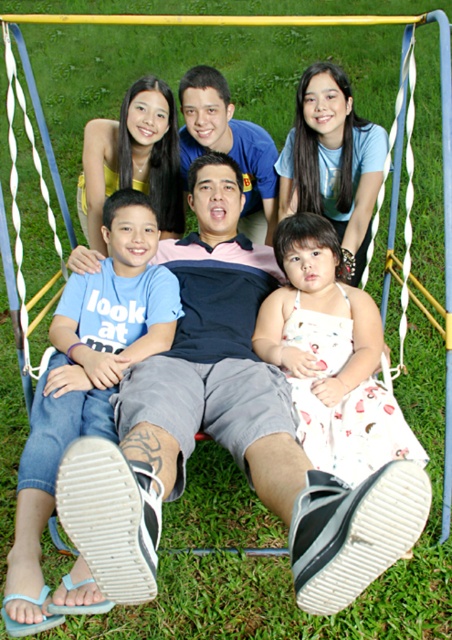
Question: Which point appears farthest from the camera in this image?

Choices:
 (A) (345, 444)
 (B) (169, 280)

Answer: (B)

Question: Can you confirm if blue cotton shirt at lower left is positioned above white floral dress at center?

Choices:
 (A) yes
 (B) no

Answer: (B)

Question: Can you confirm if blue cotton shirt at lower left is bigger than white floral dress at center?

Choices:
 (A) no
 (B) yes

Answer: (B)

Question: Considering the relative positions of blue cotton shirt at lower left and white floral dress at center in the image provided, where is blue cotton shirt at lower left located with respect to white floral dress at center?

Choices:
 (A) left
 (B) right

Answer: (A)